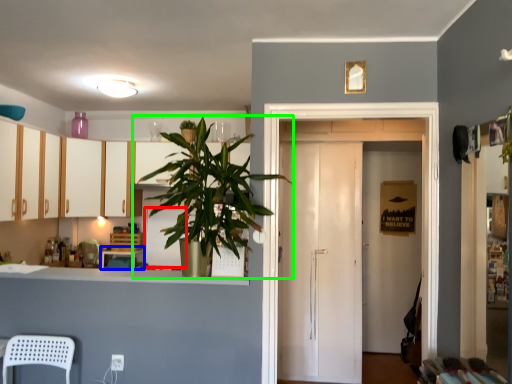
Question: Which is nearer to the appliance (highlighted by a red box)? table (highlighted by a blue box) or houseplant (highlighted by a green box).

Choices:
 (A) table
 (B) houseplant

Answer: (A)